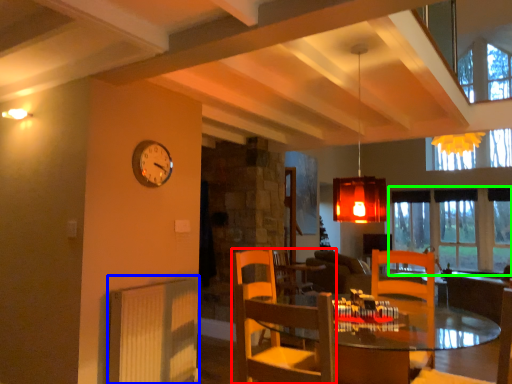
Question: Which object is the closest to the chair (highlighted by a red box)? Choose among these: radiator (highlighted by a blue box) or window (highlighted by a green box).

Choices:
 (A) radiator
 (B) window

Answer: (A)